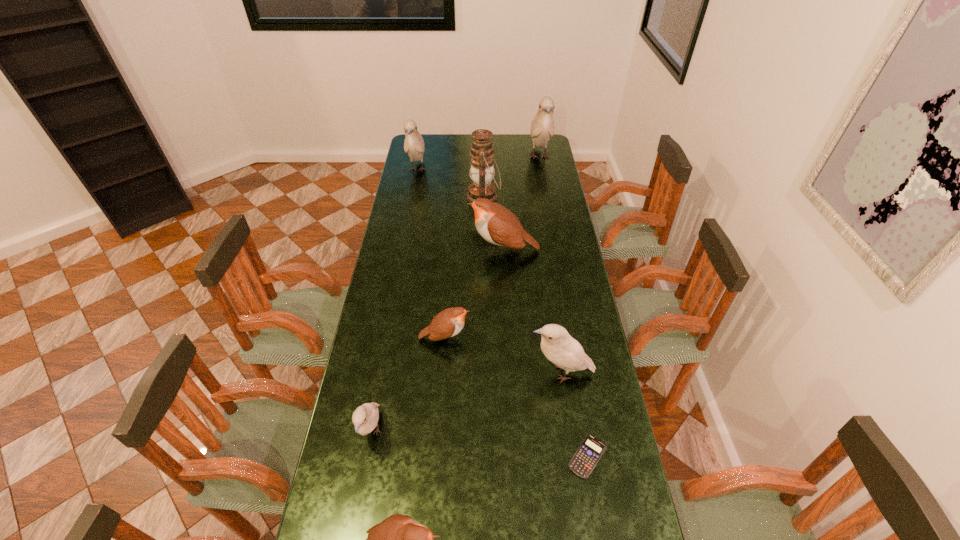
Where is `vacant space at the right edge of the desktop`? The height and width of the screenshot is (540, 960). vacant space at the right edge of the desktop is located at coordinates (570, 228).

Locate an element on the screen. The width and height of the screenshot is (960, 540). vacant space at the far left corner of the desktop is located at coordinates (428, 150).

This screenshot has width=960, height=540. Identify the location of empty location between the shortest object and the third biggest white bird. (574, 415).

I want to click on empty space that is in between the sixth farthest bird and the smallest brown bird, so click(x=408, y=385).

Where is `vacant area that lies between the lantern and the tallest bird`? vacant area that lies between the lantern and the tallest bird is located at coordinates (512, 177).

Find the location of a particular element. This screenshot has width=960, height=540. vacant space that's between the eighth tallest object and the calculator is located at coordinates (516, 397).

I want to click on vacant space that is in between the sixth nearest object and the sixth shortest bird, so click(x=461, y=210).

Find the location of a particular element. Image resolution: width=960 pixels, height=540 pixels. free spot between the shortest bird and the shortest object is located at coordinates (516, 397).

The image size is (960, 540). Identify the location of empty space between the smallest white bird and the second tallest bird. (395, 301).

The height and width of the screenshot is (540, 960). Identify the location of the second closest object to the lantern. pyautogui.click(x=542, y=127).